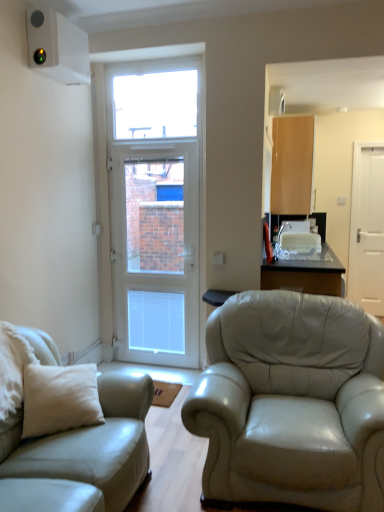
What is the approximate width of transparent glass window at upper center?

It is 2.24 inches.

What do you see at coordinates (155, 99) in the screenshot? I see `transparent glass window at upper center` at bounding box center [155, 99].

This screenshot has width=384, height=512. What are the coordinates of `transparent glass table at center` in the screenshot? It's located at (305, 273).

The width and height of the screenshot is (384, 512). Describe the element at coordinates (367, 229) in the screenshot. I see `white matte door at right, which is the second door in left-to-right order` at that location.

This screenshot has width=384, height=512. What are the coordinates of `transparent glass window at upper center` in the screenshot? It's located at (155, 99).

Is light beige leather couch at left outside of light brown wood cabinet at upper right?

light beige leather couch at left is positioned outside light brown wood cabinet at upper right.

Is light beige leather couch at left looking in the opposite direction of light brown wood cabinet at upper right?

No, light beige leather couch at left is not facing away from light brown wood cabinet at upper right.

Is point (99, 382) more distant than point (287, 138)?

No, (99, 382) is closer to viewer.

Between light beige leather couch at left and light brown wood cabinet at upper right, which one has smaller size?

light brown wood cabinet at upper right.

From the picture: Which is farther, (284, 147) or (280, 273)?

The point (284, 147) is farther from the camera.

From a real-world perspective, who is located lower, light brown wood cabinet at upper right or transparent glass table at center?

transparent glass table at center is physically lower.

Looking at their sizes, would you say light brown wood cabinet at upper right is wider or thinner than transparent glass table at center?

Clearly, light brown wood cabinet at upper right has less width compared to transparent glass table at center.

Which object is positioned more to the left, light brown wood cabinet at upper right or transparent glass table at center?

From the viewer's perspective, transparent glass table at center appears more on the left side.

Which is in front, point (339, 283) or point (164, 79)?

The point (339, 283) is closer.

From a real-world perspective, is transparent glass table at center physically located above or below transparent glass window at upper center?

transparent glass table at center is situated lower than transparent glass window at upper center in the real world.

How different are the orientations of transparent glass table at center and transparent glass window at upper center in degrees?

The facing directions of transparent glass table at center and transparent glass window at upper center are 89.7 degrees apart.

Does transparent glass table at center have a lesser width compared to transparent glass window at upper center?

No.

Could you tell me if light brown wood cabinet at upper right is facing white matte door at right, the 2th door when ordered from front to back?

Yes, light brown wood cabinet at upper right faces towards white matte door at right, the 2th door when ordered from front to back.

Is light brown wood cabinet at upper right behind white matte door at right, which appears as the first door when viewed from the back?

No, light brown wood cabinet at upper right is in front of white matte door at right, which appears as the first door when viewed from the back.

Considering the relative sizes of light brown wood cabinet at upper right and white matte door at right, which is the second door in left-to-right order, in the image provided, is light brown wood cabinet at upper right taller than white matte door at right, which is the second door in left-to-right order,?

Incorrect, the height of light brown wood cabinet at upper right is not larger of that of white matte door at right, which is the second door in left-to-right order.

In terms of height, does white glossy door at center, the second door when ordered from right to left, look taller or shorter compared to transparent glass table at center?

Considering their sizes, white glossy door at center, the second door when ordered from right to left, has more height than transparent glass table at center.

Between white glossy door at center, the second door when ordered from right to left, and transparent glass table at center, which one has smaller size?

With smaller size is white glossy door at center, the second door when ordered from right to left.

Which point is more distant from viewer, (129, 154) or (320, 254)?

The point (320, 254) is more distant.

Where is `the 1st door positioned above the transparent glass table at center (from a real-world perspective)`? the 1st door positioned above the transparent glass table at center (from a real-world perspective) is located at coordinates (154, 205).

How distant is transparent glass table at center from white glossy door at center, the second door when ordered from right to left?

transparent glass table at center and white glossy door at center, the second door when ordered from right to left, are 3.75 feet apart from each other.

Does transparent glass table at center turn towards white glossy door at center, arranged as the first door when viewed from the front?

No, transparent glass table at center is not oriented towards white glossy door at center, arranged as the first door when viewed from the front.

Do you think transparent glass table at center is within white glossy door at center, the 2th door in the back-to-front sequence, or outside of it?

The correct answer is: outside.

Looking at their sizes, would you say transparent glass table at center is wider or thinner than white glossy door at center, the 2th door in the back-to-front sequence?

transparent glass table at center is wider than white glossy door at center, the 2th door in the back-to-front sequence.

From the image's perspective, which is below, white glossy door at center, the second door when ordered from right to left, or transparent glass window at upper center?

white glossy door at center, the second door when ordered from right to left, appears lower in the image.

Is white glossy door at center, arranged as the first door when viewed from the front, at the left side of transparent glass window at upper center?

Correct, you'll find white glossy door at center, arranged as the first door when viewed from the front, to the left of transparent glass window at upper center.

Considering the sizes of white glossy door at center, the second door when ordered from right to left, and transparent glass window at upper center in the image, is white glossy door at center, the second door when ordered from right to left, wider or thinner than transparent glass window at upper center?

In the image, white glossy door at center, the second door when ordered from right to left, appears to be wider than transparent glass window at upper center.

From a real-world perspective, starting from the transparent glass window at upper center, which door is the 2nd one below it? Please provide its 2D coordinates.

[(154, 205)]

Where is `cabinetry behind the light beige leather couch at left`? The height and width of the screenshot is (512, 384). cabinetry behind the light beige leather couch at left is located at coordinates (292, 165).

At what (x,y) coordinates should I click in order to perform the action: click on cabinetry above the transparent glass table at center (from a real-world perspective). Please return your answer as a coordinate pair (x, y). Image resolution: width=384 pixels, height=512 pixels. Looking at the image, I should click on (292, 165).

Looking at the image, which one is located closer to light beige leather couch at left, transparent glass window at upper center or white glossy door at center, the 2th door in the back-to-front sequence?

The object closer to light beige leather couch at left is white glossy door at center, the 2th door in the back-to-front sequence.

Which object lies further to the anchor point transparent glass window at upper center, white glossy door at center, the 2th door in the back-to-front sequence, or light brown wood cabinet at upper right?

Based on the image, light brown wood cabinet at upper right appears to be further to transparent glass window at upper center.

Based on their spatial positions, is light brown wood cabinet at upper right or white glossy door at center, the first door in the left-to-right sequence, closer to transparent glass window at upper center?

white glossy door at center, the first door in the left-to-right sequence, is positioned closer to the anchor transparent glass window at upper center.

Based on the photo, which object lies nearer to the anchor point light brown wood cabinet at upper right, white matte door at right, which appears as the first door when viewed from the back, or transparent glass window at upper center?

white matte door at right, which appears as the first door when viewed from the back, lies closer to light brown wood cabinet at upper right than the other object.

Which object lies further to the anchor point transparent glass table at center, white glossy door at center, the 2th door in the back-to-front sequence, or transparent glass window at upper center?

Based on the image, transparent glass window at upper center appears to be further to transparent glass table at center.

Which object lies nearer to the anchor point light beige leather couch at left, white matte door at right, the first door positioned from the right, or transparent glass window at upper center?

The object closer to light beige leather couch at left is transparent glass window at upper center.

Estimate the real-world distances between objects in this image. Which object is closer to transparent glass window at upper center, transparent glass table at center or white matte door at right, the 2th door when ordered from front to back?

transparent glass table at center.

Which object lies nearer to the anchor point white matte door at right, the first door positioned from the right, transparent glass window at upper center or transparent glass table at center?

transparent glass table at center.

You are a GUI agent. You are given a task and a screenshot of the screen. Output one action in this format:
    pyautogui.click(x=<x>, y=<y>)
    Task: Click on the window between white glossy door at center, the second door when ordered from right to left, and light brown wood cabinet at upper right, in the horizontal direction
    The width and height of the screenshot is (384, 512).
    Given the screenshot: What is the action you would take?
    pyautogui.click(x=155, y=99)

This screenshot has width=384, height=512. Identify the location of cabinetry between transparent glass table at center and white matte door at right, which appears as the first door when viewed from the back, in the front-back direction. (292, 165).

You are a GUI agent. You are given a task and a screenshot of the screen. Output one action in this format:
    pyautogui.click(x=<x>, y=<y>)
    Task: Click on the table between light beige leather couch at left and white glossy door at center, the second door when ordered from right to left, along the z-axis
    The width and height of the screenshot is (384, 512).
    Given the screenshot: What is the action you would take?
    pyautogui.click(x=305, y=273)

At what (x,y) coordinates should I click in order to perform the action: click on window located between light beige leather couch at left and white matte door at right, which is the second door in left-to-right order, in the depth direction. Please return your answer as a coordinate pair (x, y). Image resolution: width=384 pixels, height=512 pixels. Looking at the image, I should click on (155, 99).